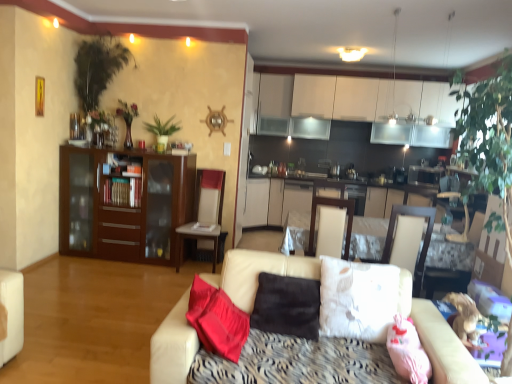
Question: Would you say green leafy plant at upper center is inside or outside brown suede pillow at center, the first pillow viewed from the left?

Choices:
 (A) inside
 (B) outside

Answer: (B)

Question: Is point (159, 145) closer or farther from the camera than point (313, 306)?

Choices:
 (A) closer
 (B) farther

Answer: (B)

Question: Based on their relative distances, which object is nearer to the leather couch at center?

Choices:
 (A) brown wood cabinet at left
 (B) green leafy plant at upper center
 (C) white leather armchair at center
 (D) pink fabric pillow at lower right, positioned as the 2th pillow in left-to-right order
 (E) brown suede pillow at center, the first pillow viewed from the left

Answer: (D)

Question: Considering the real-world distances, which object is closest to the white leather swivel chair at center?

Choices:
 (A) green leafy plant at upper center
 (B) brown suede pillow at center, the first pillow viewed from the left
 (C) brown wood cabinet at left
 (D) white leather chair at center
 (E) leather couch at center

Answer: (E)